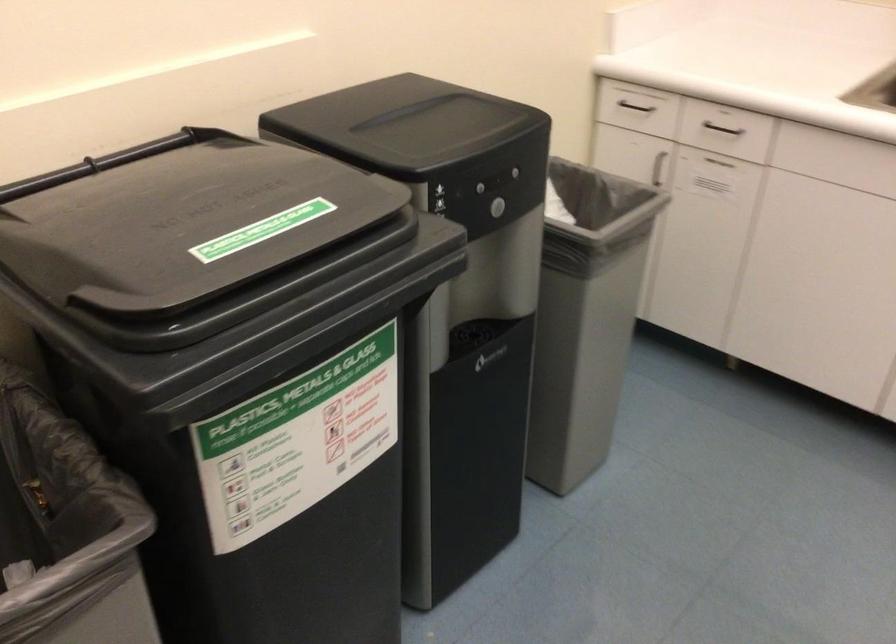
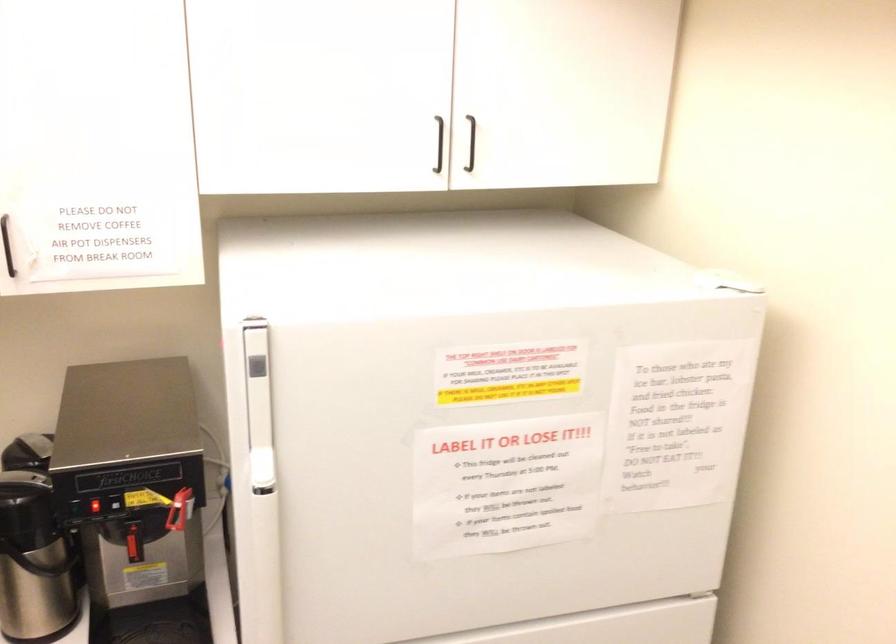
Question: The first image is from the beginning of the video and the second image is from the end. How did the camera likely rotate when shooting the video?

Choices:
 (A) Left
 (B) Right
 (C) Up
 (D) Down

Answer: (B)